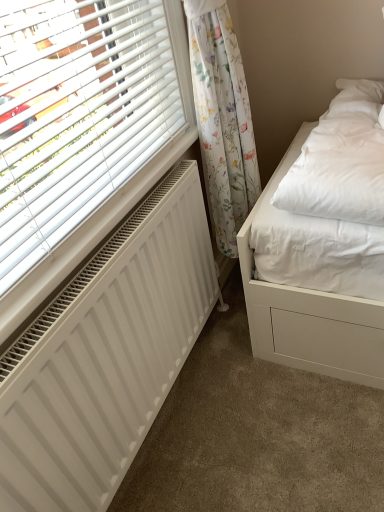
Question: Is there a large distance between white matte radiator at lower left and floral fabric curtain at upper right?

Choices:
 (A) yes
 (B) no

Answer: (B)

Question: Considering the relative positions of white matte radiator at lower left and floral fabric curtain at upper right in the image provided, is white matte radiator at lower left to the left of floral fabric curtain at upper right from the viewer's perspective?

Choices:
 (A) no
 (B) yes

Answer: (B)

Question: From the image's perspective, does white matte radiator at lower left appear higher than floral fabric curtain at upper right?

Choices:
 (A) no
 (B) yes

Answer: (A)

Question: Can floral fabric curtain at upper right be found inside white matte radiator at lower left?

Choices:
 (A) yes
 (B) no

Answer: (B)

Question: From a real-world perspective, is white matte radiator at lower left beneath floral fabric curtain at upper right?

Choices:
 (A) no
 (B) yes

Answer: (B)

Question: Is white matte radiator at lower left positioned with its back to floral fabric curtain at upper right?

Choices:
 (A) yes
 (B) no

Answer: (B)

Question: Is floral fabric curtain at upper right far away from white matte radiator at lower left?

Choices:
 (A) yes
 (B) no

Answer: (B)

Question: Considering the relative sizes of floral fabric curtain at upper right and white matte radiator at lower left in the image provided, is floral fabric curtain at upper right bigger than white matte radiator at lower left?

Choices:
 (A) no
 (B) yes

Answer: (B)

Question: From a real-world perspective, does floral fabric curtain at upper right stand above white matte radiator at lower left?

Choices:
 (A) yes
 (B) no

Answer: (A)

Question: Is floral fabric curtain at upper right aimed at white matte radiator at lower left?

Choices:
 (A) no
 (B) yes

Answer: (A)

Question: Would you say floral fabric curtain at upper right contains white matte radiator at lower left?

Choices:
 (A) no
 (B) yes

Answer: (A)

Question: Is floral fabric curtain at upper right to the left of white matte radiator at lower left from the viewer's perspective?

Choices:
 (A) no
 (B) yes

Answer: (A)

Question: Which is correct: floral fabric curtain at upper right is inside white matte radiator at lower left, or outside of it?

Choices:
 (A) outside
 (B) inside

Answer: (A)